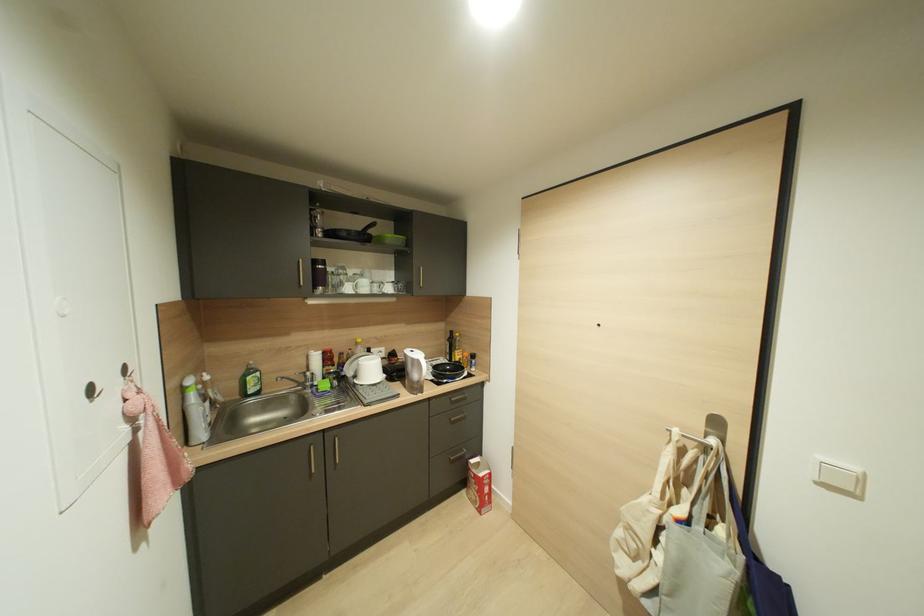
Find the location of a particular element. Image resolution: width=924 pixels, height=616 pixels. white mug handle is located at coordinates (427, 369).